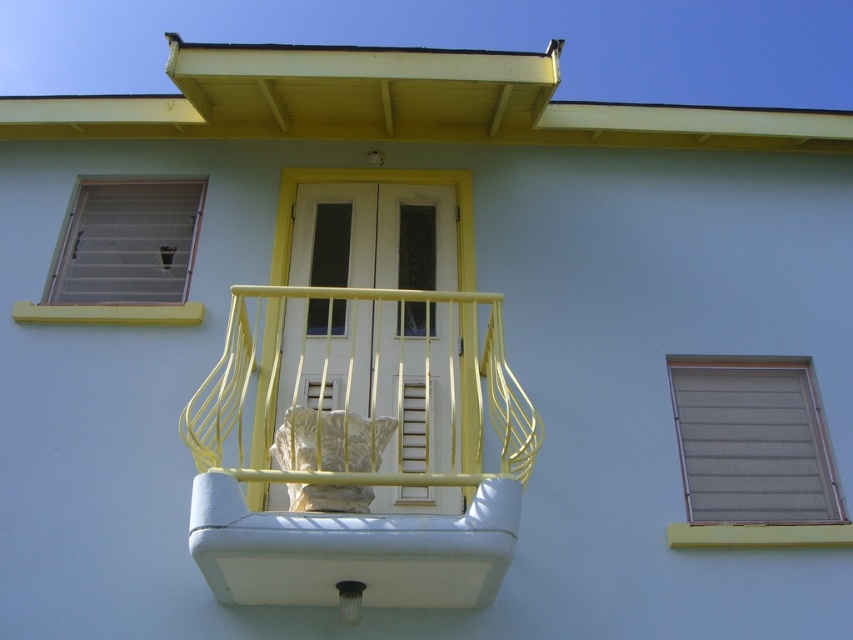
Question: Which object appears closest to the camera in this image?

Choices:
 (A) matte gray window at right
 (B) white matte shutter at center

Answer: (B)

Question: Does matte gray window at right have a lesser width compared to yellow matte/finish window sill at upper center?

Choices:
 (A) no
 (B) yes

Answer: (B)

Question: Which object appears farthest from the camera in this image?

Choices:
 (A) metallic yellow balcony at center
 (B) matte gray window at right
 (C) white matte shutter at center
 (D) yellow matte/finish window sill at upper center

Answer: (D)

Question: Does matte gray shutters at upper left lie in front of yellow matte/finish window sill at upper center?

Choices:
 (A) yes
 (B) no

Answer: (B)

Question: Can you confirm if matte gray window at right is positioned below yellow painted wood at lower right?

Choices:
 (A) yes
 (B) no

Answer: (B)

Question: Which object is the closest to the matte gray window at right?

Choices:
 (A) matte gray shutters at upper left
 (B) white matte shutter at center

Answer: (B)